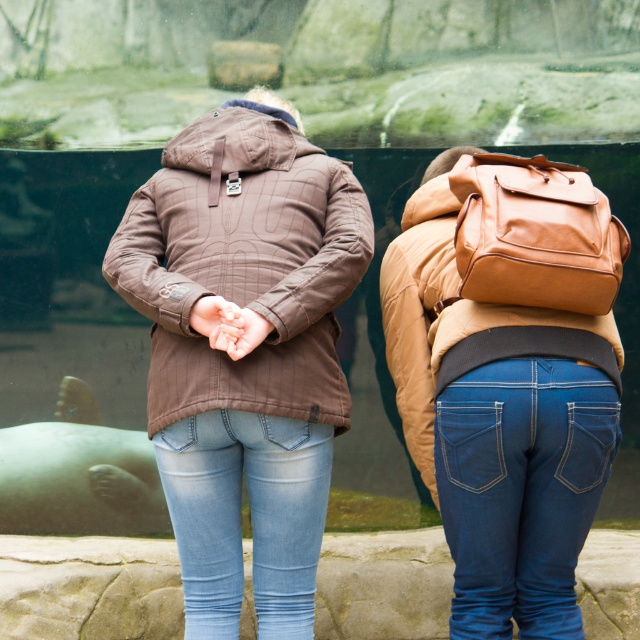
Question: Among these objects, which one is nearest to the camera?

Choices:
 (A) denim jeans at center
 (B) light blue denim jeans at center

Answer: (A)

Question: Which point is farther to the camera?

Choices:
 (A) (403, 296)
 (B) (244, 388)
 (C) (451, 472)
 (D) (324, 500)

Answer: (A)

Question: Where is brown quilted jacket at center located in relation to denim jeans at center in the image?

Choices:
 (A) right
 (B) left

Answer: (B)

Question: Which of the following is the farthest from the observer?

Choices:
 (A) denim jeans at center
 (B) brown quilted jacket at center
 (C) light blue denim jeans at center
 (D) brown leather jacket at upper right

Answer: (D)

Question: Can you confirm if brown quilted jacket at center is bigger than brown leather jacket at upper right?

Choices:
 (A) yes
 (B) no

Answer: (B)

Question: Observing the image, what is the correct spatial positioning of brown quilted jacket at center in reference to light blue denim jeans at center?

Choices:
 (A) above
 (B) below

Answer: (A)